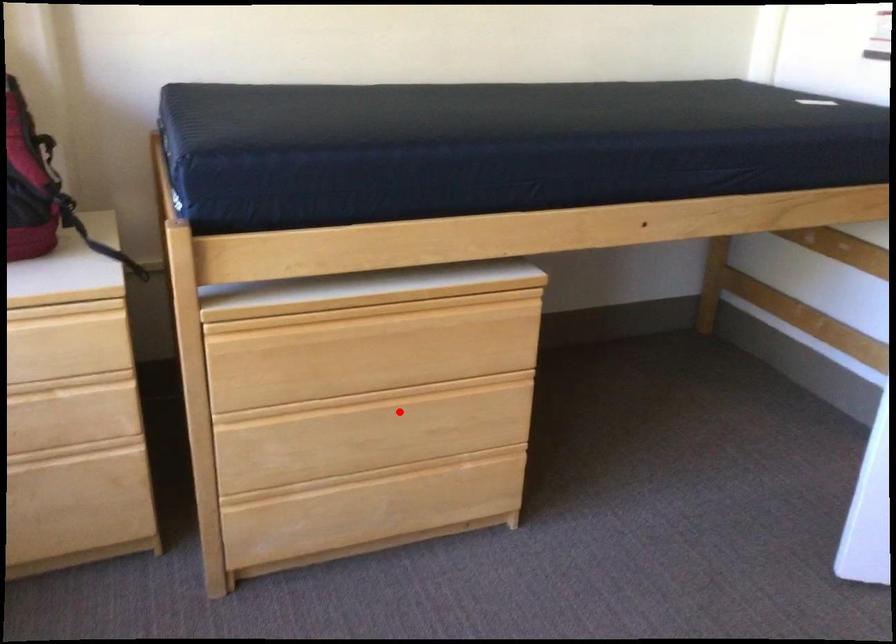
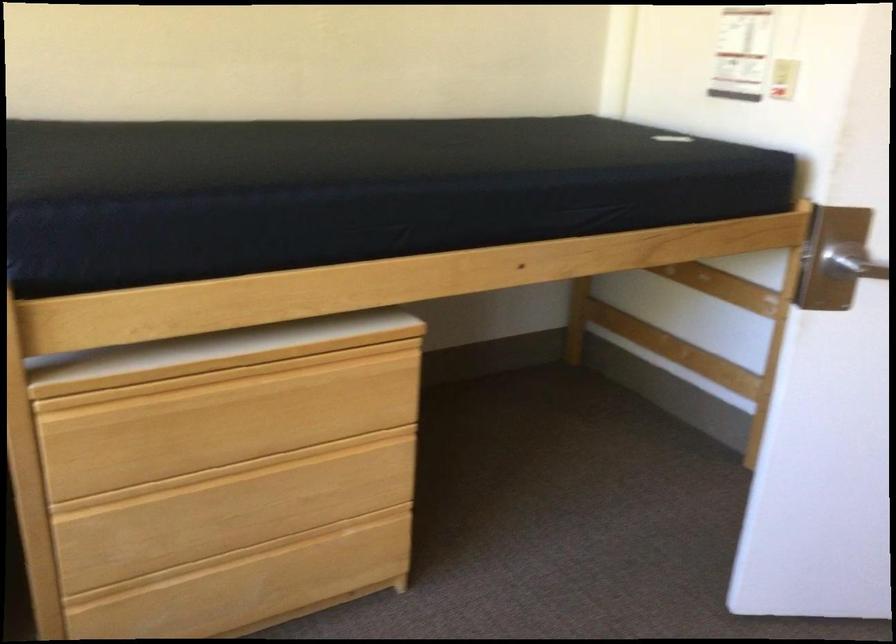
Locate, in the second image, the point that corresponds to the highlighted location in the first image.

(266, 486)